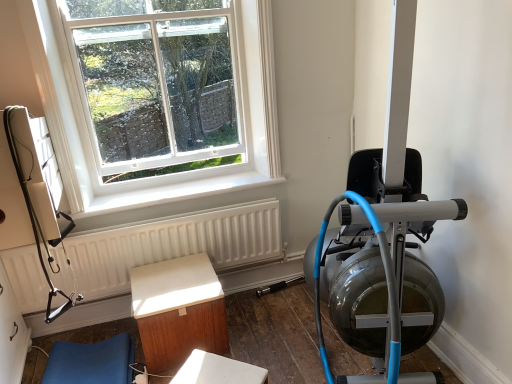
Identify the location of vacant area on top of light brown wood table at center, the first furniture when ordered from right to left (from a real-world perspective). The height and width of the screenshot is (384, 512). (170, 280).